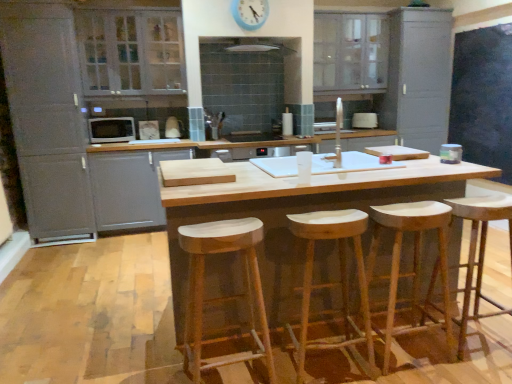
The image size is (512, 384). Find the location of `vacant area situated below natural wood stool at center, the second stool viewed from the left (from a real-world perspective)`. vacant area situated below natural wood stool at center, the second stool viewed from the left (from a real-world perspective) is located at coordinates coord(331,362).